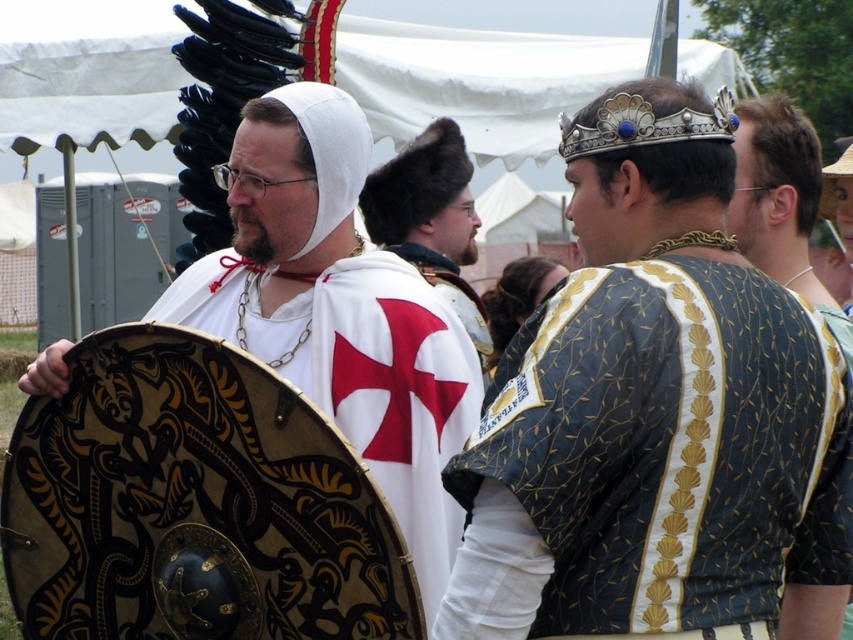
You are a photographer positioned at the camera. You want to capture a closeup shot of the gold embroidered tunic at center. Considering your current position, can you get a clear closeup without moving closer than 3.96 meters?

The gold embroidered tunic at center is 3.96 meters from the camera, so you can capture a clear closeup without moving closer than that distance.

You are a photographer trying to capture the two points in the image. Which point, point (503, 381) or point (230, 260), will appear larger in your photo?

Point (503, 381) is closer to the camera than point (230, 260), so it will appear larger in the photo.